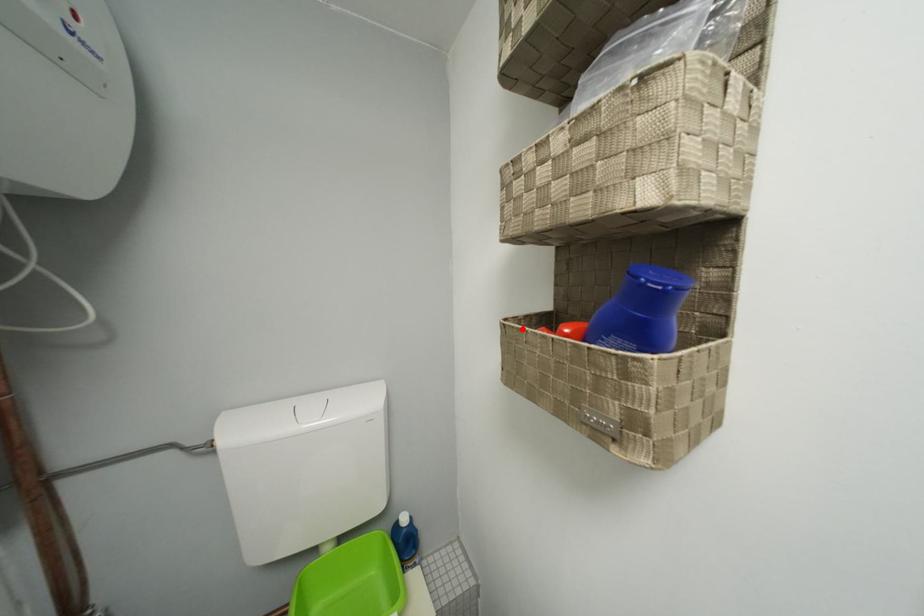
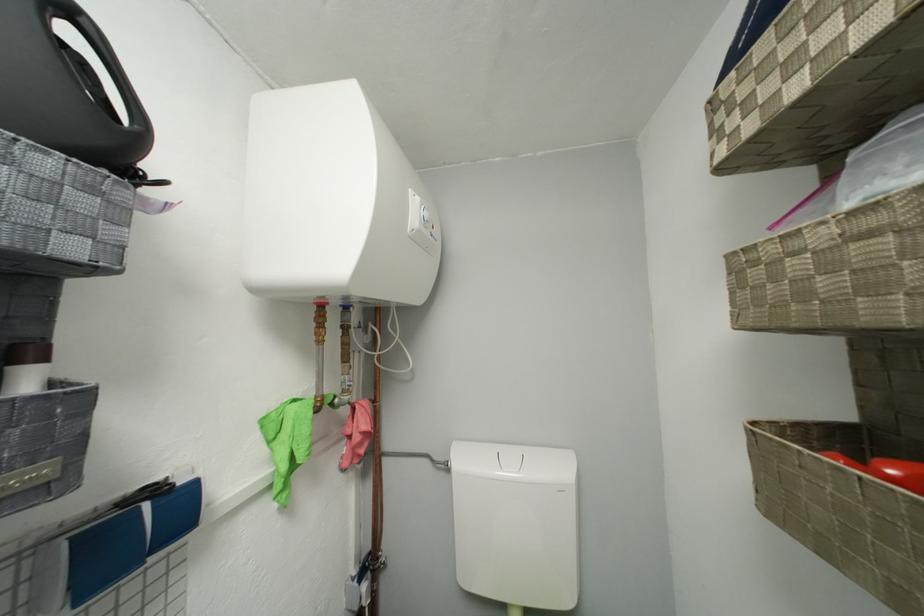
Find the pixel in the second image that matches the highlighted location in the first image.

(781, 442)